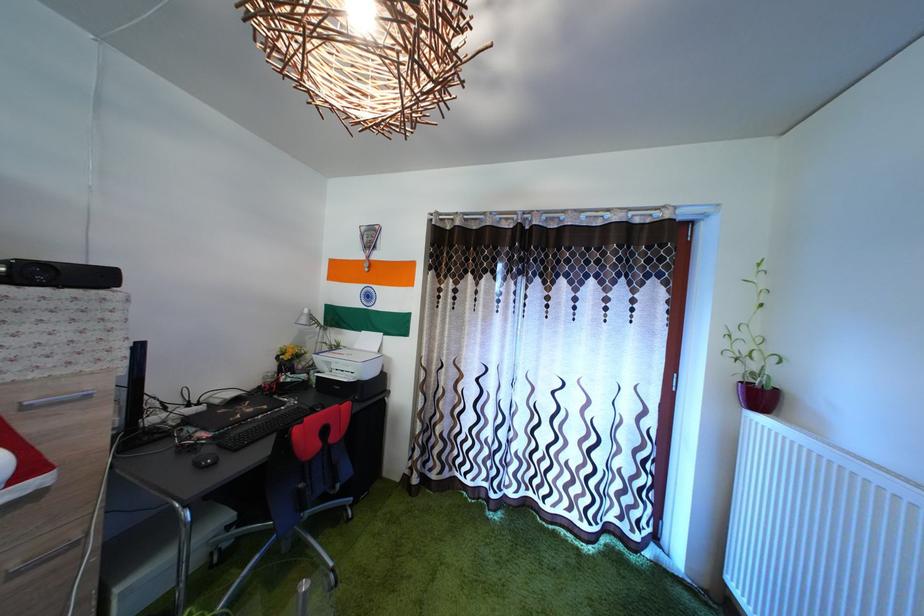
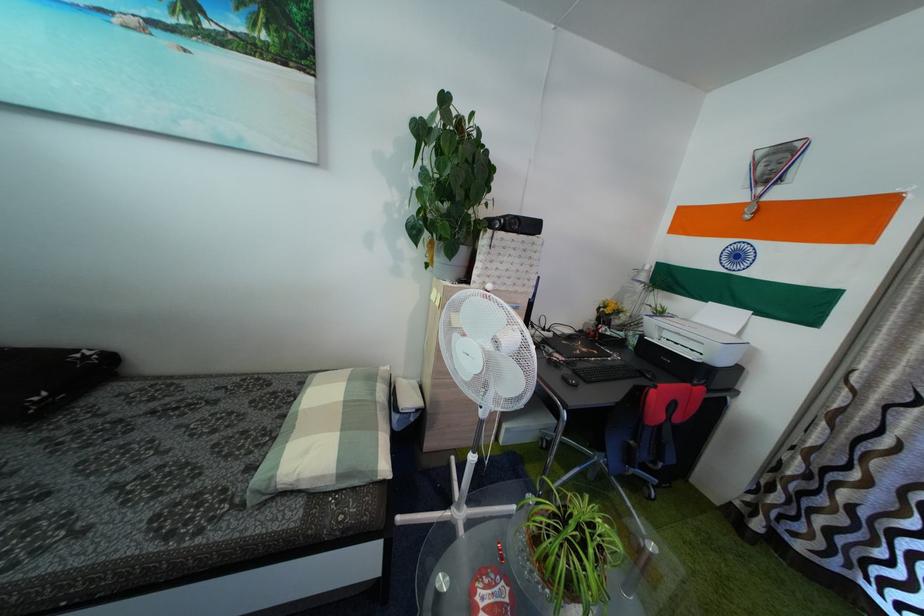
The point at (x=363, y=354) is marked in the first image. Where is the corresponding point in the second image?

(703, 328)